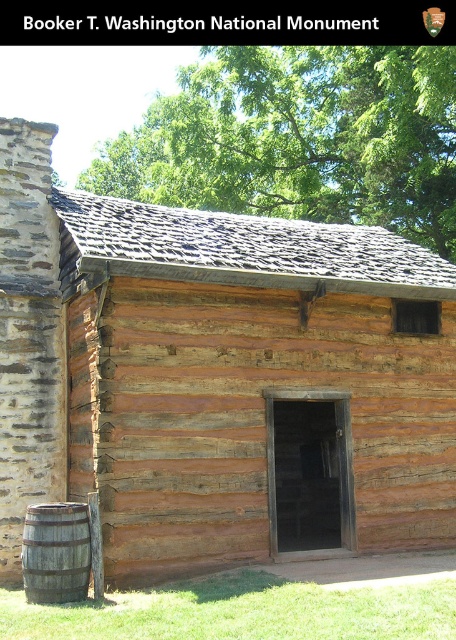
You are standing at the base of the rustic wooden barrel at lower left and want to enter the weathered wood cabin at center. Which direction should you move to reach the cabin?

The weathered wood cabin at center is located above rustic wooden barrel at lower left, so you should move upward to reach the cabin.